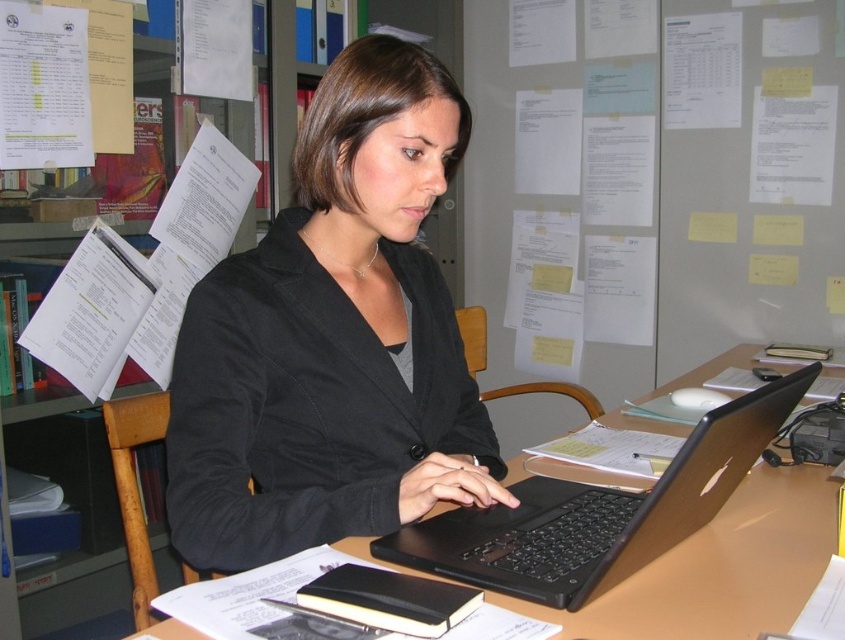
Is point (428, 92) positioned behind point (582, 497)?

No, it is in front of (582, 497).

Does black matte blazer at center appear on the right side of black plastic laptop at center?

Incorrect, black matte blazer at center is not on the right side of black plastic laptop at center.

Identify the location of black matte blazer at center. (333, 339).